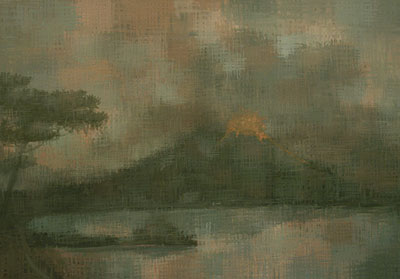
Identify the location of corner. This screenshot has height=279, width=400. (393, 7).